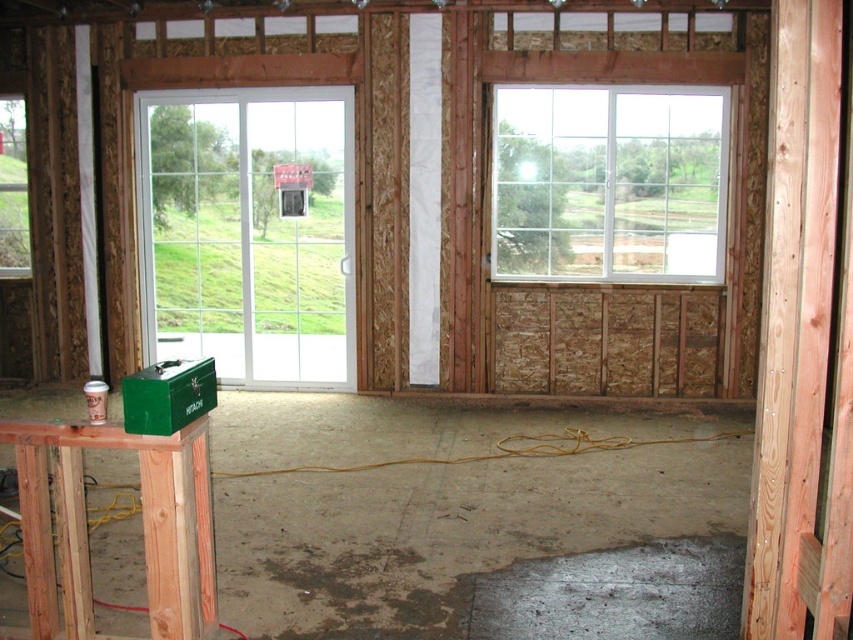
Is point (317, 196) less distant than point (534, 221)?

No.

Does white glass door at left have a greater height compared to white plastic window at upper right?

Yes, white glass door at left is taller than white plastic window at upper right.

Which is behind, point (161, 154) or point (656, 204)?

The point (161, 154) is more distant.

The width and height of the screenshot is (853, 640). I want to click on white glass door at left, so click(x=248, y=232).